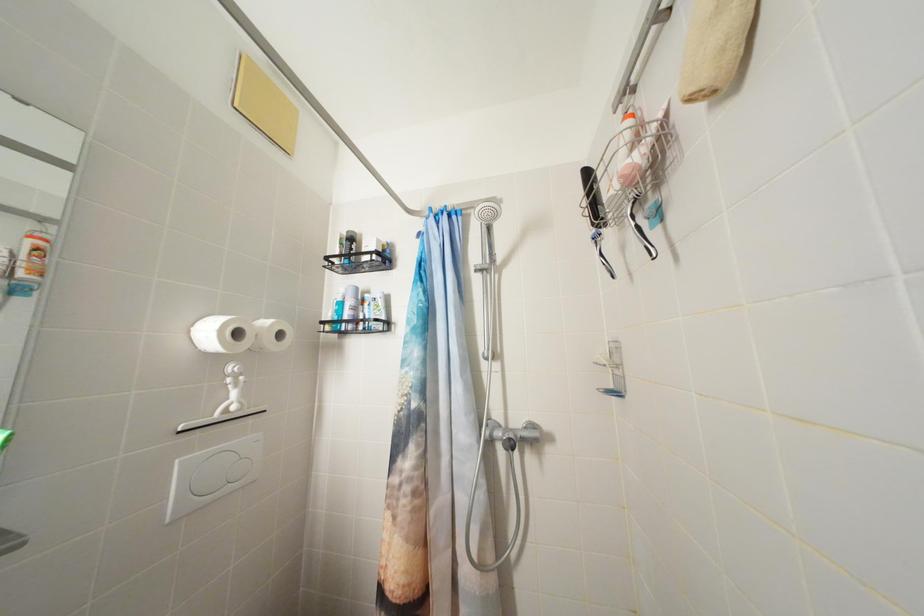
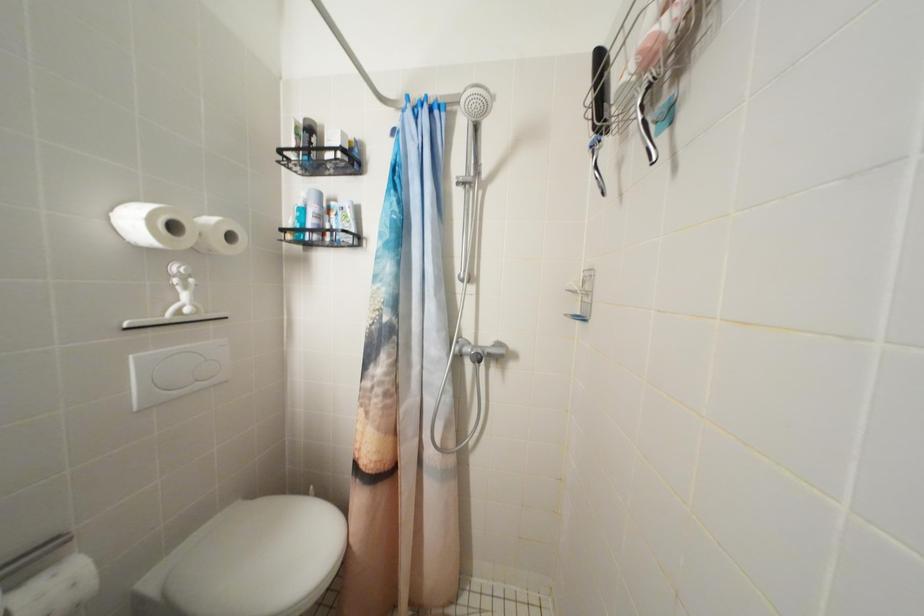
In a continuous first-person perspective shot, in which direction is the camera moving?

The cameraman moved toward right, forward.